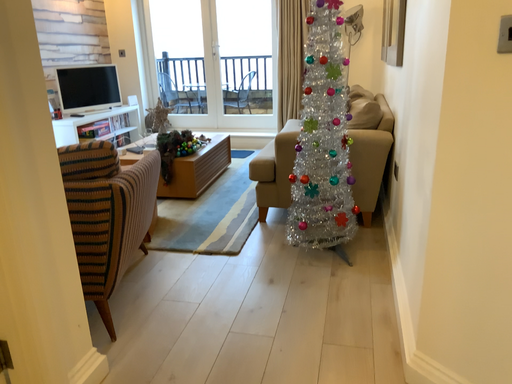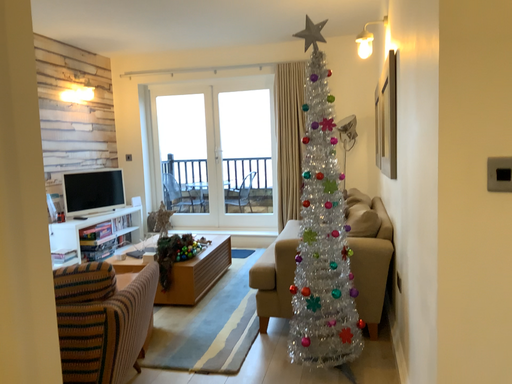
Question: How did the camera likely rotate when shooting the video?

Choices:
 (A) rotated upward
 (B) rotated downward

Answer: (A)